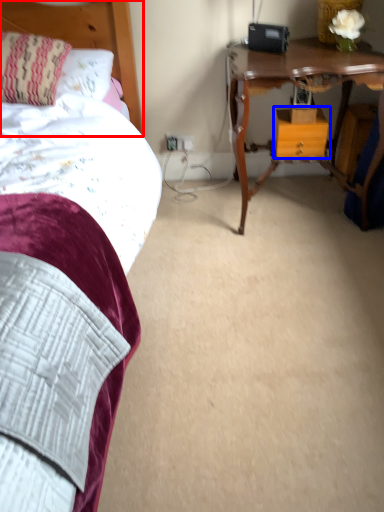
Question: Which of the following is the farthest to the observer, headboard (highlighted by a red box) or nightstand (highlighted by a blue box)?

Choices:
 (A) headboard
 (B) nightstand

Answer: (B)